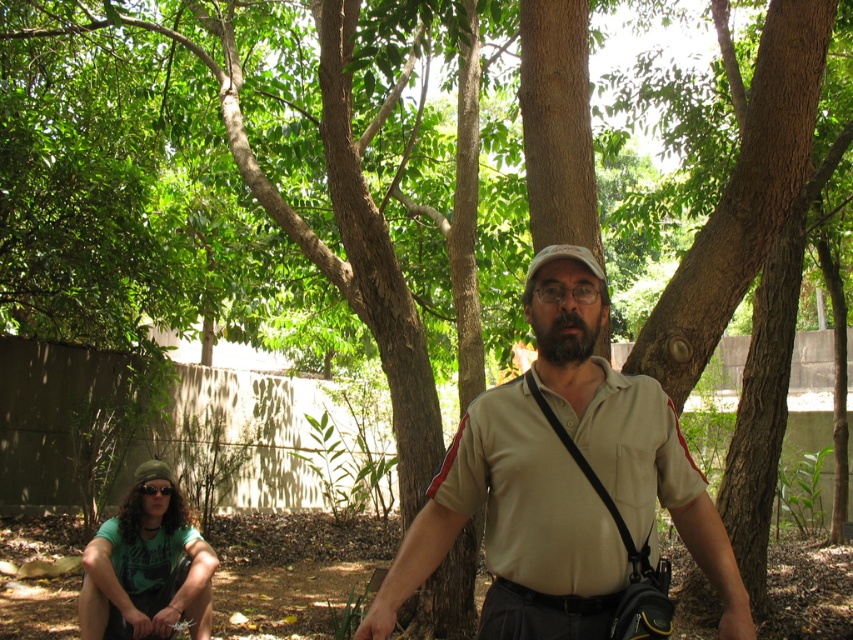
You are a photographer trying to capture a photo of the beige cotton shirt at center. Based on its position in the image coordinates, where should you aim your camera?

The beige cotton shirt at center is located at point 0.825 on the x axis and 0.601 on the y axis, so aim your camera at those coordinates to capture it.

You are standing at the point marked as point [512,528] in the image. Looking around, you see a beige cotton shirt at center. Which direction should you face to look towards the beige cotton shirt at center?

The point [512,528] corresponds to the beige cotton shirt at center, so you are already facing it.